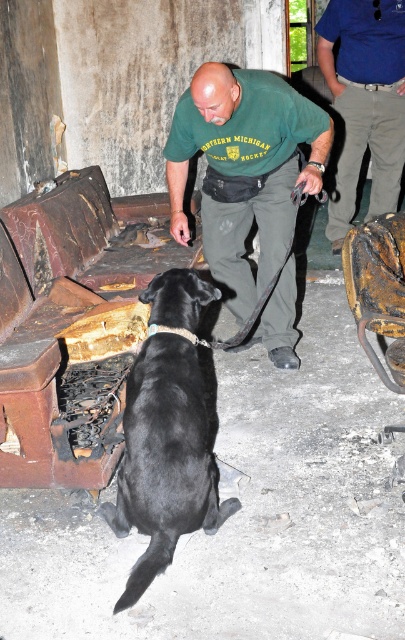
Question: Does green fabric shirt at center have a smaller size compared to blue cotton shirt at upper right?

Choices:
 (A) yes
 (B) no

Answer: (B)

Question: Which point is farther from the camera taking this photo?

Choices:
 (A) (292, 365)
 (B) (172, 353)
 (C) (347, 60)

Answer: (C)

Question: Does green fabric shirt at center have a smaller size compared to blue cotton shirt at upper right?

Choices:
 (A) no
 (B) yes

Answer: (A)

Question: Does green fabric shirt at center have a smaller size compared to black smooth fur dog at center?

Choices:
 (A) yes
 (B) no

Answer: (B)

Question: Among these objects, which one is farthest from the camera?

Choices:
 (A) blue cotton shirt at upper right
 (B) black smooth fur dog at center
 (C) green fabric shirt at center

Answer: (A)

Question: Which point is farther to the camera?

Choices:
 (A) blue cotton shirt at upper right
 (B) green fabric shirt at center
 (C) black smooth fur dog at center

Answer: (A)